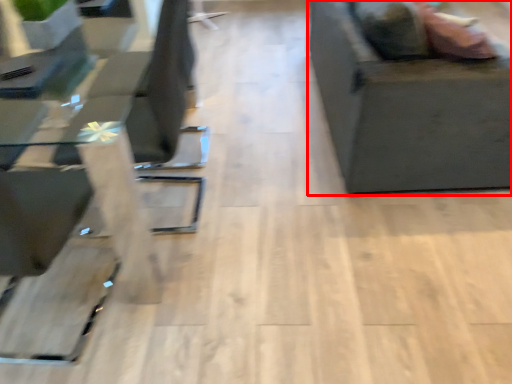
Question: From the image's perspective, where is furniture (annotated by the red box) located relative to table?

Choices:
 (A) below
 (B) above

Answer: (B)